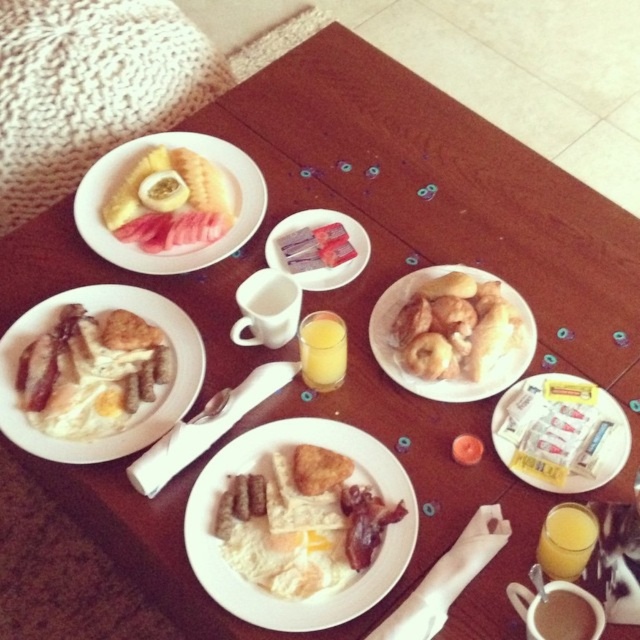
Between matte white plate with breakfast items at center and matte plastic plate at center, which one appears on the right side from the viewer's perspective?

From the viewer's perspective, matte plastic plate at center appears more on the right side.

Can you confirm if matte white plate with breakfast items at center is positioned to the right of matte plastic plate at center?

Incorrect, matte white plate with breakfast items at center is not on the right side of matte plastic plate at center.

Is point (276, 429) behind point (337, 276)?

No.

At what (x,y) coordinates should I click in order to perform the action: click on matte white plate with breakfast items at center. Please return your answer as a coordinate pair (x, y). The width and height of the screenshot is (640, 640). Looking at the image, I should click on (268, 472).

Can you confirm if matte plastic plate at center is thinner than brown matte coffee cup at lower right?

In fact, matte plastic plate at center might be wider than brown matte coffee cup at lower right.

Does point (362, 253) come closer to viewer compared to point (579, 616)?

No.

What do you see at coordinates (324, 266) in the screenshot? This screenshot has height=640, width=640. I see `matte plastic plate at center` at bounding box center [324, 266].

Locate an element on the screen. The image size is (640, 640). matte plastic plate at center is located at coordinates (324, 266).

Who is positioned more to the left, matte plastic plate at center or translucent glass cup of orange juice at center?

Positioned to the left is matte plastic plate at center.

Is matte plastic plate at center positioned in front of translucent glass cup of orange juice at center?

No, matte plastic plate at center is further to the viewer.

Image resolution: width=640 pixels, height=640 pixels. Identify the location of matte plastic plate at center. (324, 266).